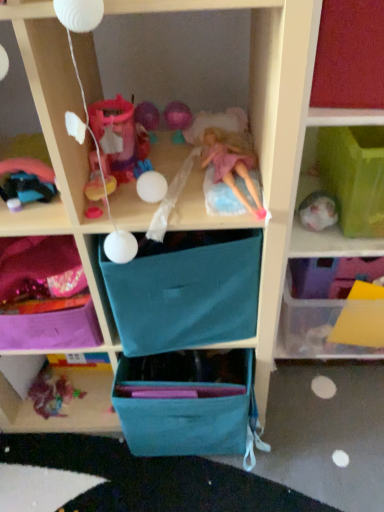
Where is `free space that is to the left of teal fabric drawer at lower center, the second drawer when ordered from top to bottom`? free space that is to the left of teal fabric drawer at lower center, the second drawer when ordered from top to bottom is located at coordinates (107, 468).